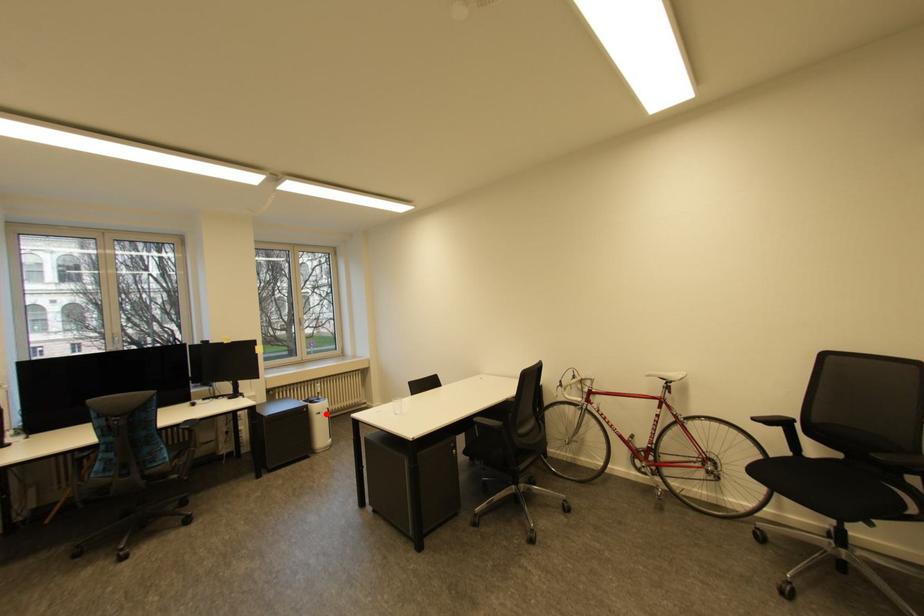
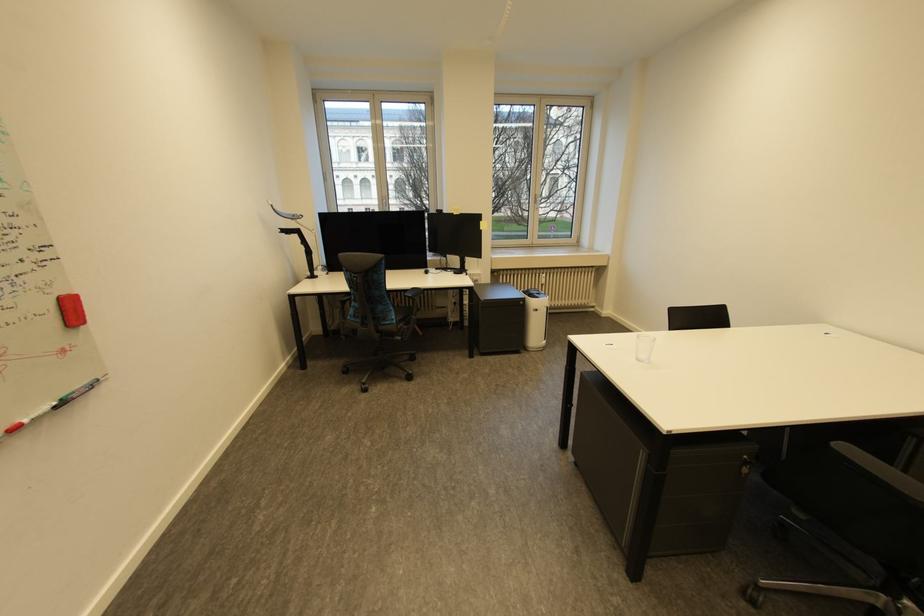
Where in the second image is the point corresponding to the highlighted location from the first image?

(543, 310)